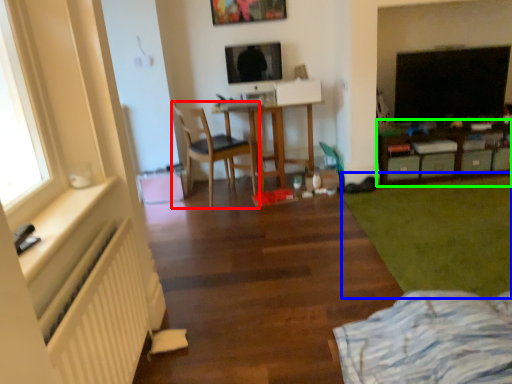
Question: Which object is the farthest from chair (highlighted by a red box)? Choose among these: grass (highlighted by a blue box) or table (highlighted by a green box).

Choices:
 (A) grass
 (B) table

Answer: (B)